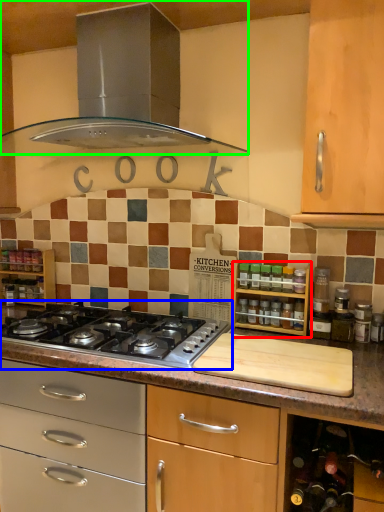
Question: Based on their relative distances, which object is farther from shelf (highlighted by a red box)? Choose from gas stove (highlighted by a blue box) and home appliance (highlighted by a green box).

Choices:
 (A) gas stove
 (B) home appliance

Answer: (B)